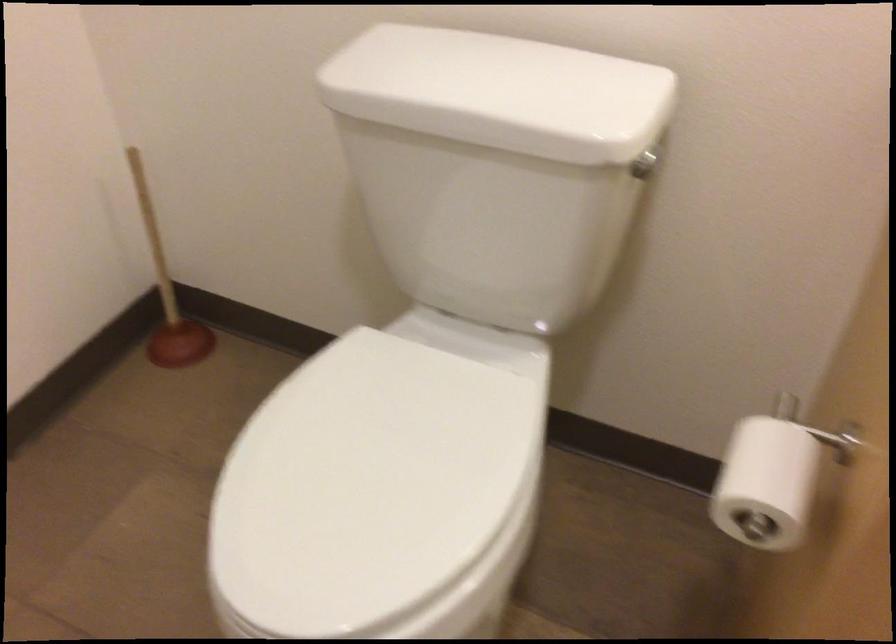
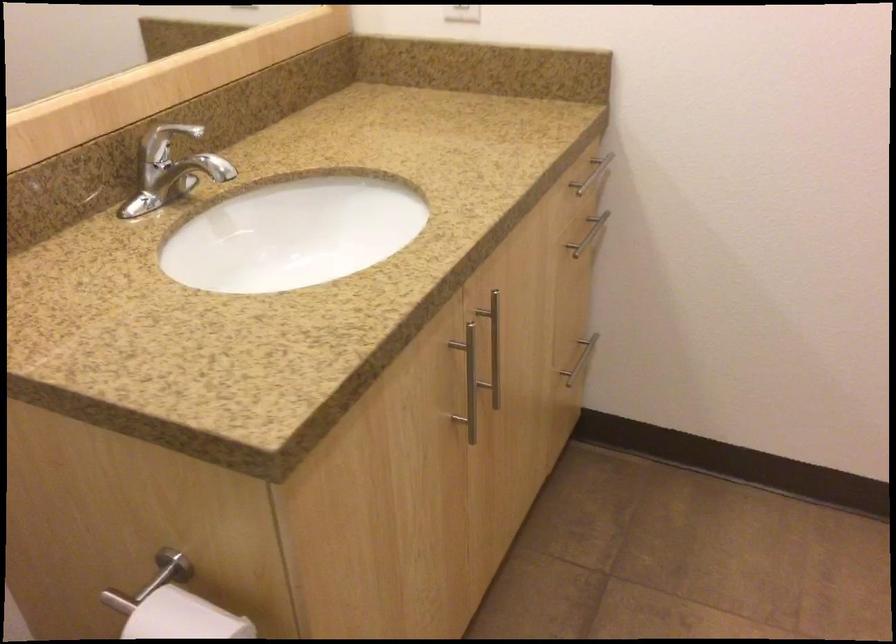
Based on the continuous images, in which direction is the camera rotating?

The camera's rotation is toward right-down.